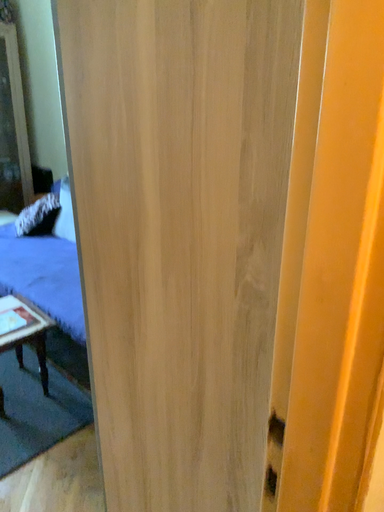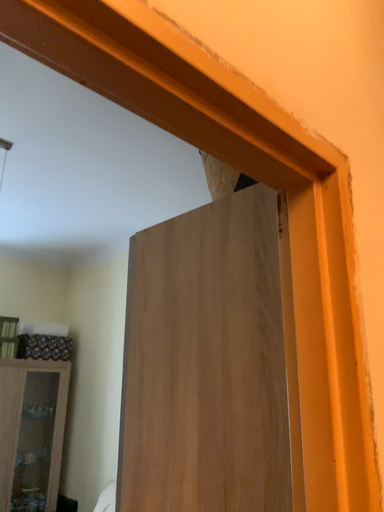
Question: How did the camera likely rotate when shooting the video?

Choices:
 (A) rotated downward
 (B) rotated upward

Answer: (B)